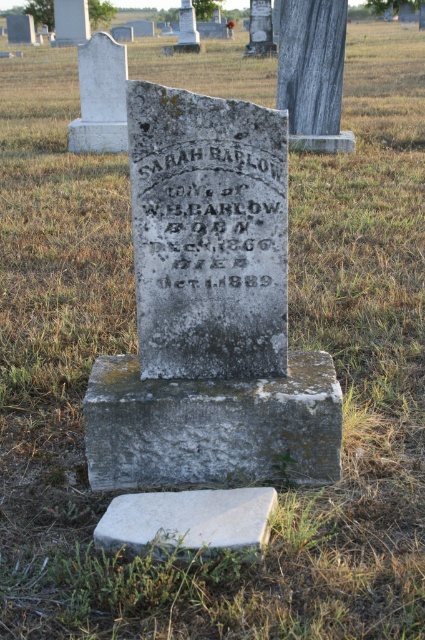
Who is more forward, (x=311, y=483) or (x=161, y=182)?

Point (x=161, y=182) is more forward.

Between gray stone base at center and dark gray stone inscription at center, which one has less height?

gray stone base at center

Who is more forward, [254,468] or [218,220]?

Positioned in front is point [218,220].

You are a GUI agent. You are given a task and a screenshot of the screen. Output one action in this format:
    pyautogui.click(x=<x>, y=<y>)
    Task: Click on the gray stone base at center
    This screenshot has width=425, height=640.
    Given the screenshot: What is the action you would take?
    coord(212,426)

Can you confirm if gray stone base at center is positioned below white stone slab at lower center?

No.

Between point (231, 467) and point (147, 531), which one is positioned behind?

The point (231, 467) is behind.

Is point (269, 464) farther from viewer compared to point (201, 525)?

Yes, it is.

The width and height of the screenshot is (425, 640). In order to click on gray stone base at center in this screenshot , I will do click(x=212, y=426).

In the scene shown: Can you confirm if dark gray stone inscription at center is wider than white stone slab at lower center?

No, dark gray stone inscription at center is not wider than white stone slab at lower center.

Does dark gray stone inscription at center come behind white stone slab at lower center?

Yes, dark gray stone inscription at center is behind white stone slab at lower center.

Is point (209, 163) positioned after point (232, 536)?

That is True.

Locate an element on the screen. The image size is (425, 640). dark gray stone inscription at center is located at coordinates (209, 224).